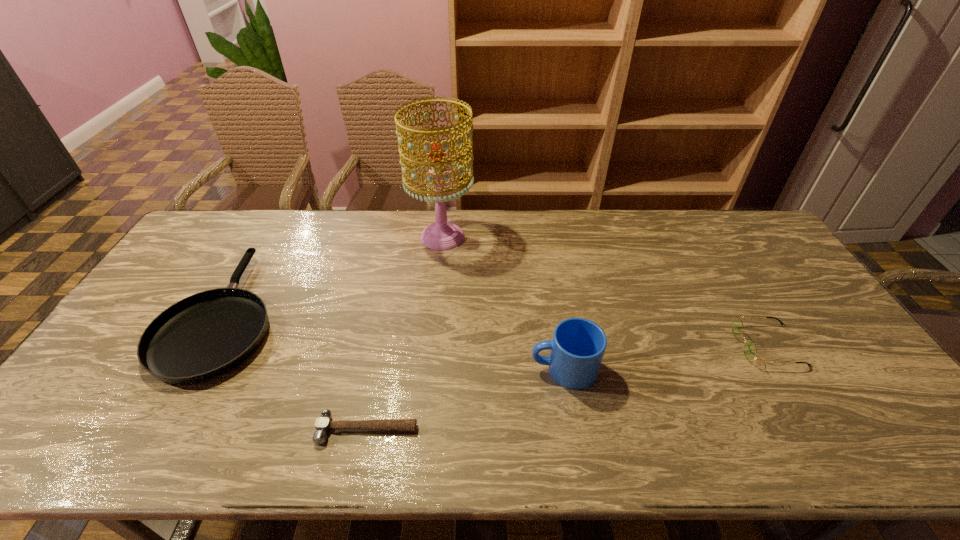
Find the location of a particular element. This screenshot has height=540, width=960. object positioned at the right edge is located at coordinates (750, 351).

Where is `free space at the far edge of the desktop`? The height and width of the screenshot is (540, 960). free space at the far edge of the desktop is located at coordinates (543, 241).

Where is `vacant space at the near edge`? vacant space at the near edge is located at coordinates (611, 454).

Where is `vacant space at the left edge`? vacant space at the left edge is located at coordinates (72, 411).

In the image, there is a desktop. Where is `free region at the right edge`? free region at the right edge is located at coordinates (820, 354).

The width and height of the screenshot is (960, 540). In the image, there is a desktop. Identify the location of vacant space at the far left corner. (229, 209).

This screenshot has width=960, height=540. I want to click on free space at the near right corner of the desktop, so click(x=858, y=440).

You are a GUI agent. You are given a task and a screenshot of the screen. Output one action in this format:
    pyautogui.click(x=<x>, y=<y>)
    Task: Click on the empty location between the lampshade and the mug
    
    Given the screenshot: What is the action you would take?
    pyautogui.click(x=503, y=303)

Where is `empty space between the mug and the rightmost object`? The image size is (960, 540). empty space between the mug and the rightmost object is located at coordinates (665, 357).

The height and width of the screenshot is (540, 960). What are the coordinates of `unoccupied area between the leftmost object and the tallest object` in the screenshot? It's located at (334, 275).